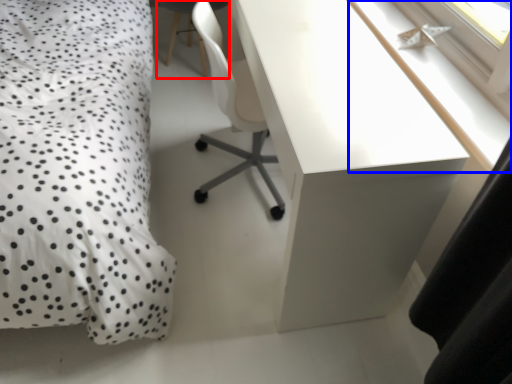
Question: Which point is closer to the camera, computer chair (highlighted by a red box) or window sill (highlighted by a blue box)?

Choices:
 (A) computer chair
 (B) window sill

Answer: (B)